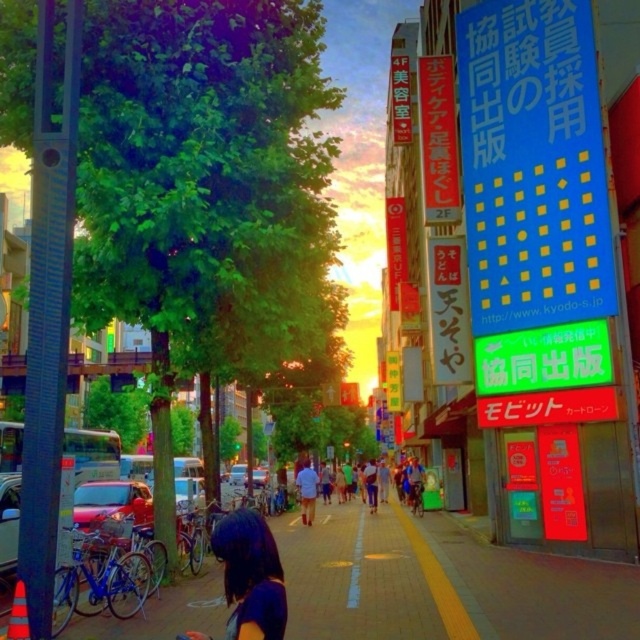
You are a person walking down the street and want to check your phone in your pocket. The denim shorts at center and light blue shirt at center are both on your body. Which clothing item is closer to your phone?

The denim shorts at center is closer to your phone because the light blue shirt at center is behind it.

You are a photographer standing on the sidewalk and want to capture both the brick pavement at center and the dark purple hair at lower center in the same frame. Which object should you focus on first to ensure both are in focus?

The brick pavement at center has a larger size compared to dark purple hair at lower center, so you should focus on the brick pavement at center first to ensure both are in focus.